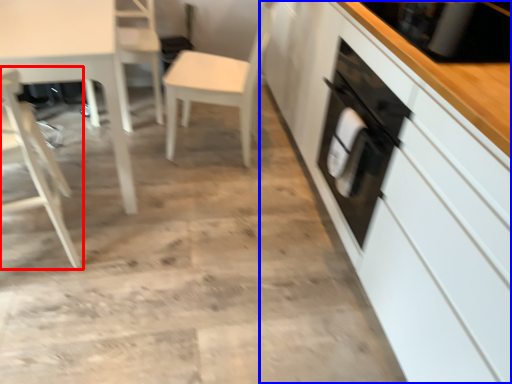
Question: Which object appears closest to the camera in this image, chair (highlighted by a red box) or cabinetry (highlighted by a blue box)?

Choices:
 (A) chair
 (B) cabinetry

Answer: (B)